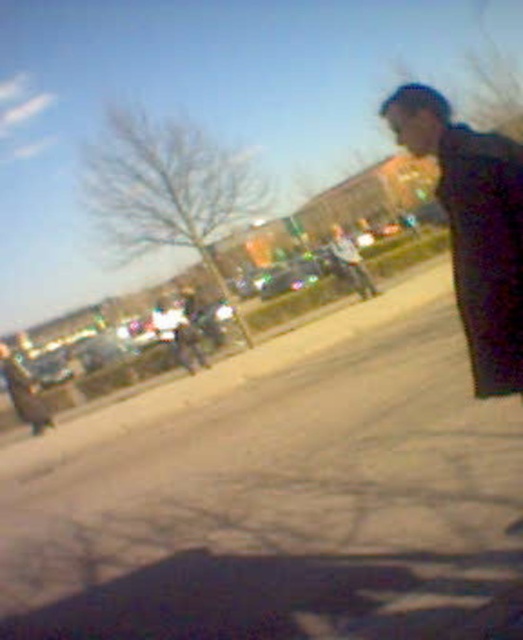
Consider the image. Is gray asphalt pavement at center positioned behind dark gray jacket at right?

Yes, gray asphalt pavement at center is behind dark gray jacket at right.

Can you confirm if gray asphalt pavement at center is taller than dark gray jacket at right?

Yes, gray asphalt pavement at center is taller than dark gray jacket at right.

Identify the location of gray asphalt pavement at center. (277, 490).

The height and width of the screenshot is (640, 523). In order to click on gray asphalt pavement at center in this screenshot , I will do click(x=277, y=490).